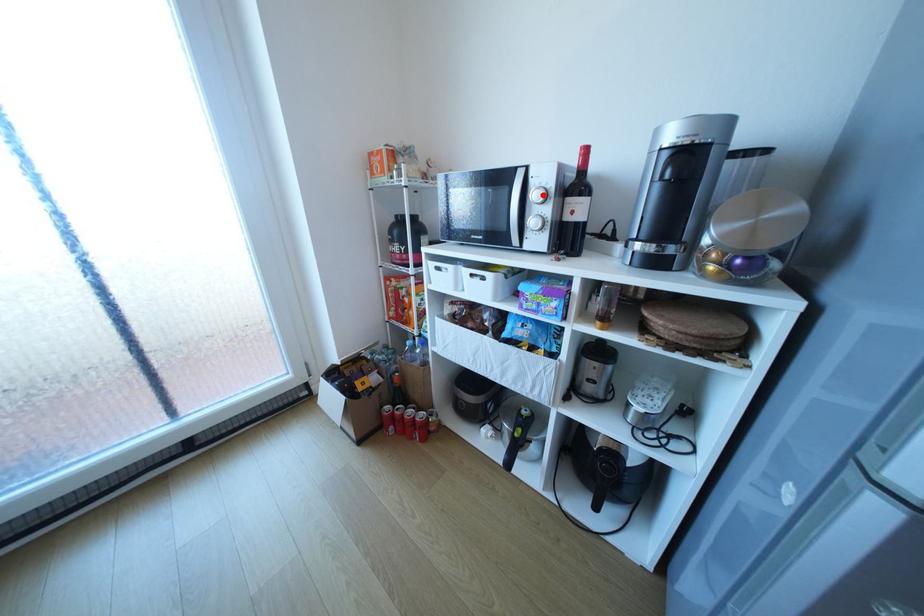
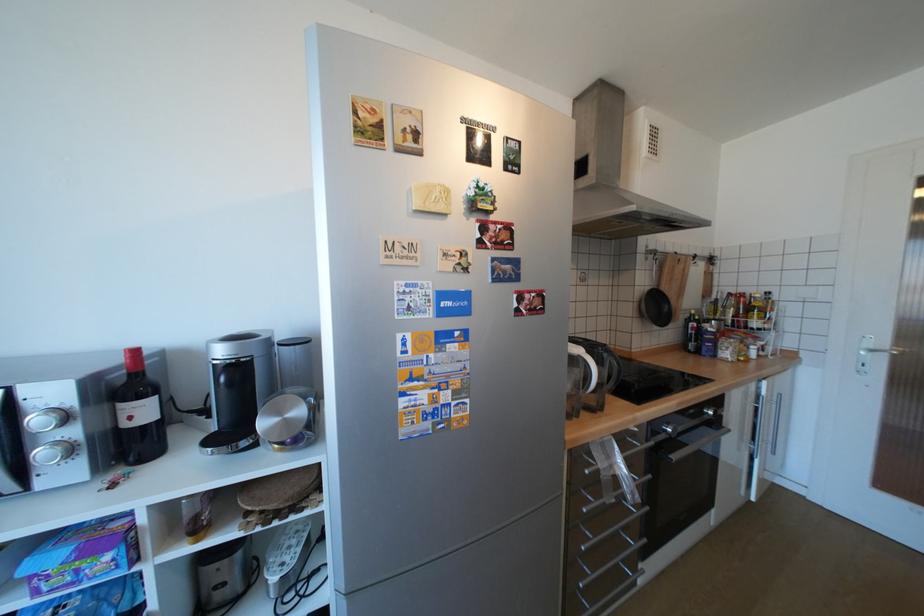
In the second image, find the point that corresponds to the highlighted location in the first image.

(46, 419)